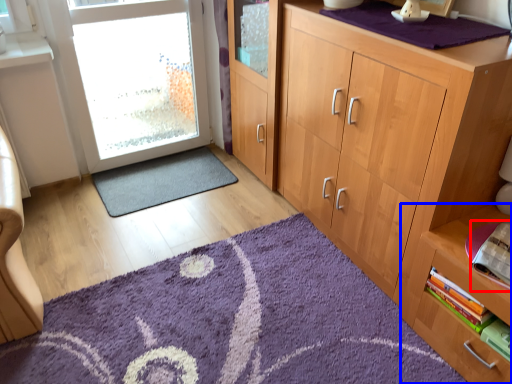
Question: Among these objects, which one is farthest to the camera, book (highlighted by a red box) or shelf (highlighted by a blue box)?

Choices:
 (A) book
 (B) shelf

Answer: (A)